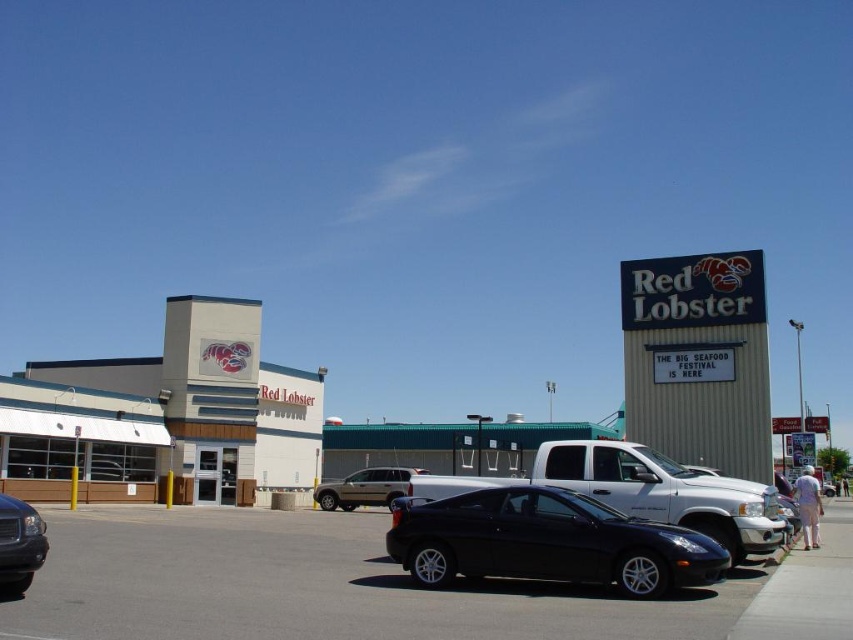
You are a customer arriving at the Red Lobster restaurant and want to park your car. You see a shiny black car at center and a shiny black sedan at lower left. Which parking spot is closer to the restaurant entrance?

The shiny black sedan at lower left is closer to the restaurant entrance because the shiny black car at center is positioned under it, indicating it is further away.